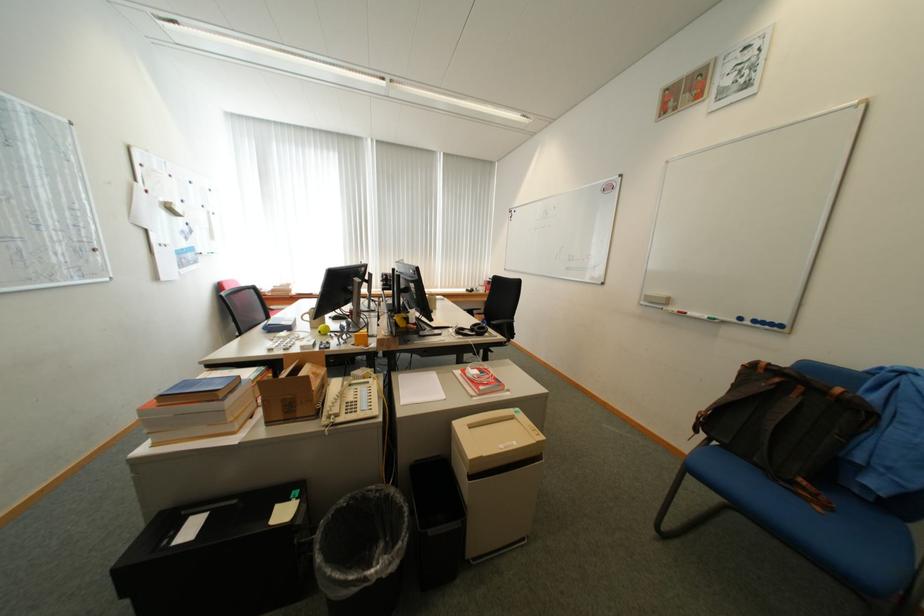
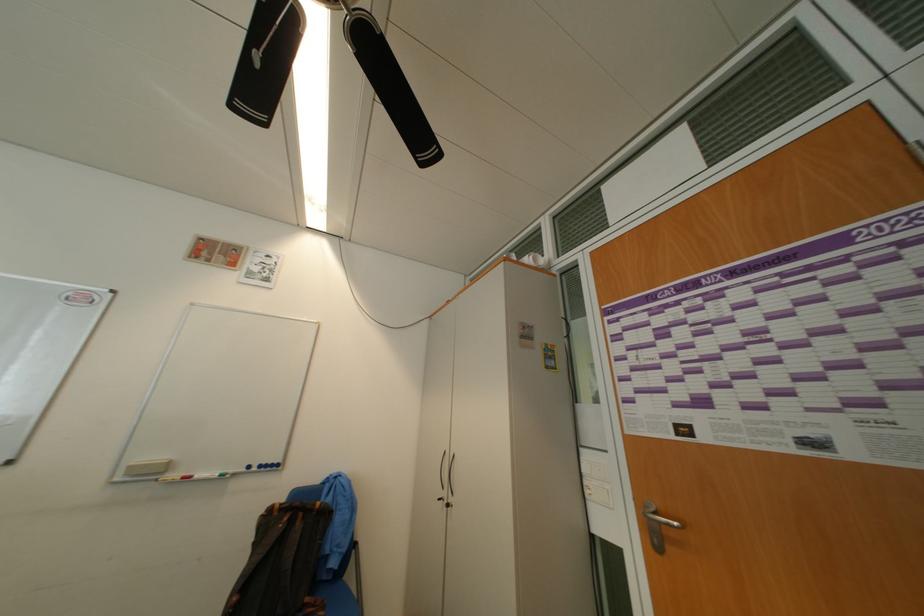
In the second image, find the point that corresponds to [651,304] in the first image.

(128, 480)